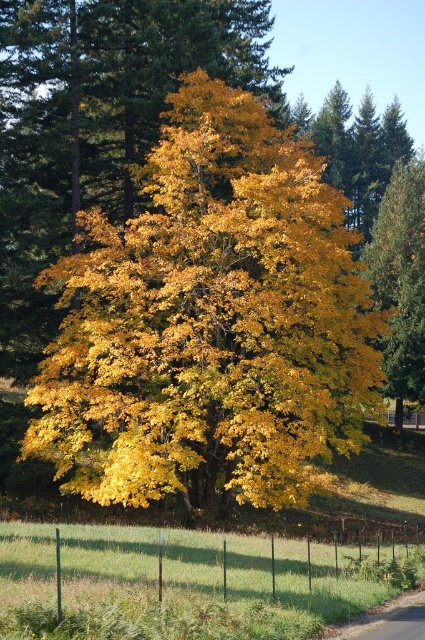
You are a landscape architect designing a new garden. You have two elements to place in the design based on the scene you see. The golden yellow leaves at center and the yellow matte tree at right. What is the minimum distance you should keep between them to maintain the natural spacing observed in the image?

The golden yellow leaves at center and the yellow matte tree at right are 12.87 meters apart from each other in the image, so the minimum distance should be at least 12.87 meters to replicate the natural spacing observed.

You are standing in the autumn scene looking at the golden yellow leaves at center and the green wire fence at lower center. Which object appears taller in the image?

The golden yellow leaves at center appears much taller than the green wire fence at lower center in the image.